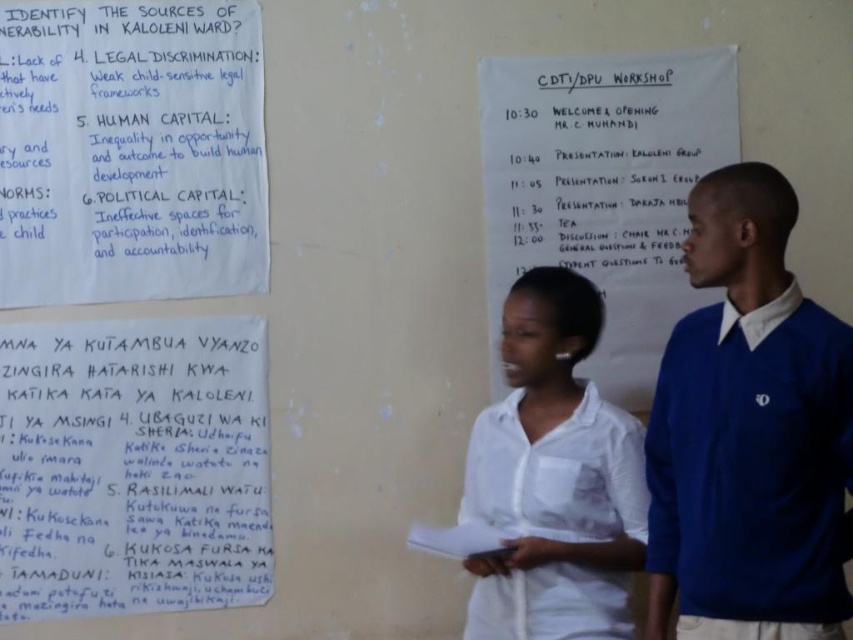
Question: Is blue fabric sweater at right above white cotton shirt at center?

Choices:
 (A) no
 (B) yes

Answer: (B)

Question: Can you confirm if white paper at center is positioned below white cotton shirt at center?

Choices:
 (A) yes
 (B) no

Answer: (B)

Question: Among these objects, which one is farthest from the camera?

Choices:
 (A) white paper at center
 (B) blue fabric sweater at right
 (C) handwritten paper at center
 (D) white cotton shirt at center

Answer: (A)

Question: Which object appears closest to the camera in this image?

Choices:
 (A) white cotton shirt at center
 (B) white paper at center
 (C) blue fabric sweater at right

Answer: (C)

Question: Is white paper at center positioned behind white cotton shirt at center?

Choices:
 (A) no
 (B) yes

Answer: (B)

Question: Based on their relative distances, which object is farther from the blue fabric sweater at right?

Choices:
 (A) handwritten paper at center
 (B) white cotton shirt at center
 (C) white paper at center

Answer: (A)